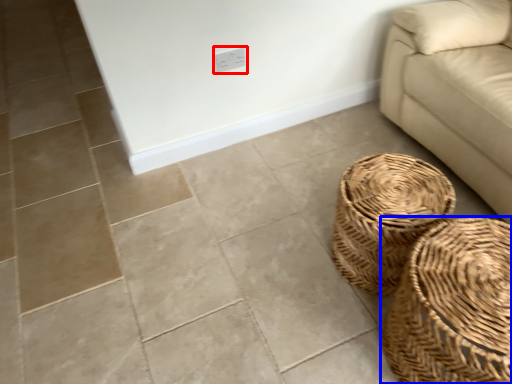
Question: Among these objects, which one is nearest to the camera, electric outlet (highlighted by a red box) or basket (highlighted by a blue box)?

Choices:
 (A) electric outlet
 (B) basket

Answer: (B)